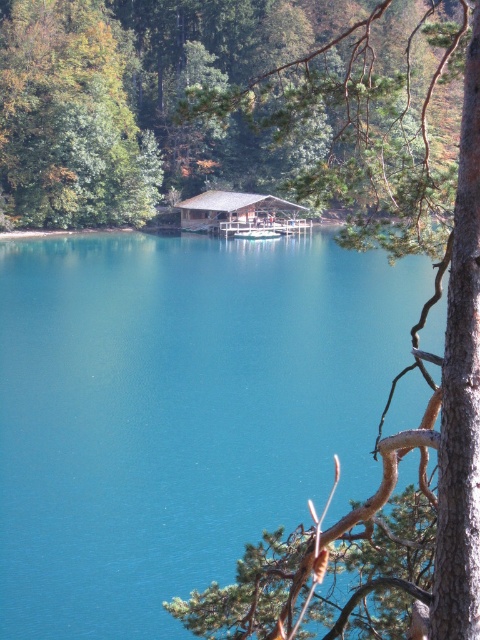
You are planning to set up a picnic blanket between the green pine branch at upper center and the brown wooden hut at center. The picnic blanket is 3 meters long. Will there be enough space between them to place the blanket end to end?

The distance between the green pine branch at upper center and the brown wooden hut at center is 28.40 meters, which is more than enough to accommodate a 3 meter long picnic blanket.

You are an observer standing at the lakeside. You notice two green elements in the scene. Which one is taller between the green pine branch at upper center and the green leafy tree at upper left?

The green pine branch at upper center is much taller than the green leafy tree at upper left.